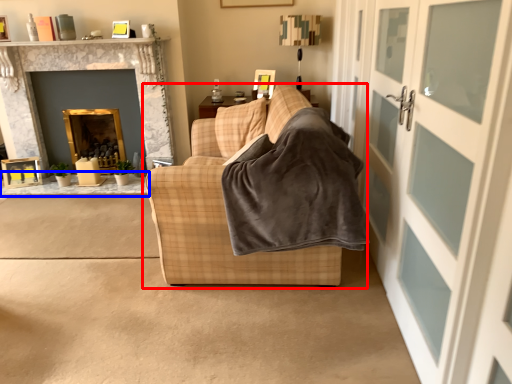
Question: Which point is closer to the camera, studio couch (highlighted by a red box) or table (highlighted by a blue box)?

Choices:
 (A) studio couch
 (B) table

Answer: (A)